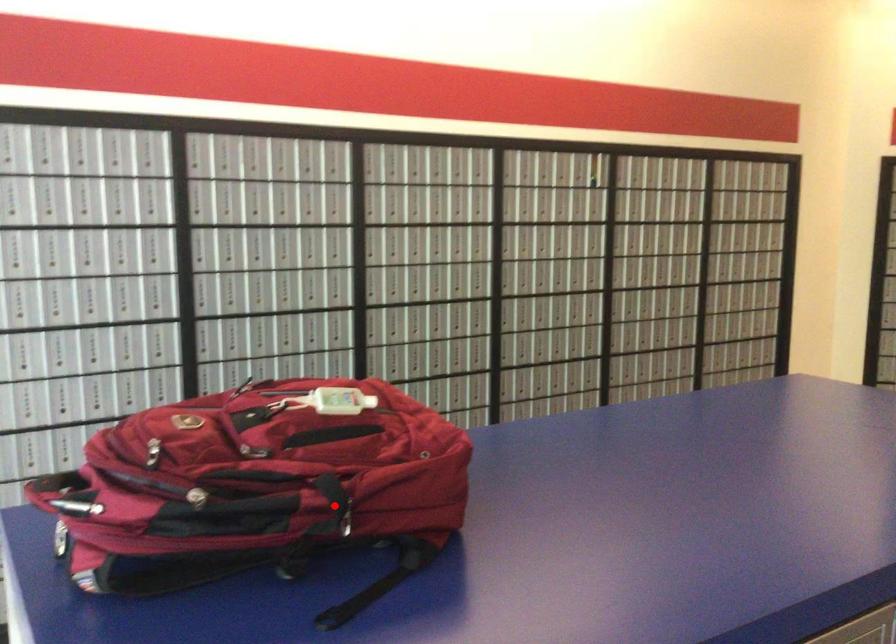
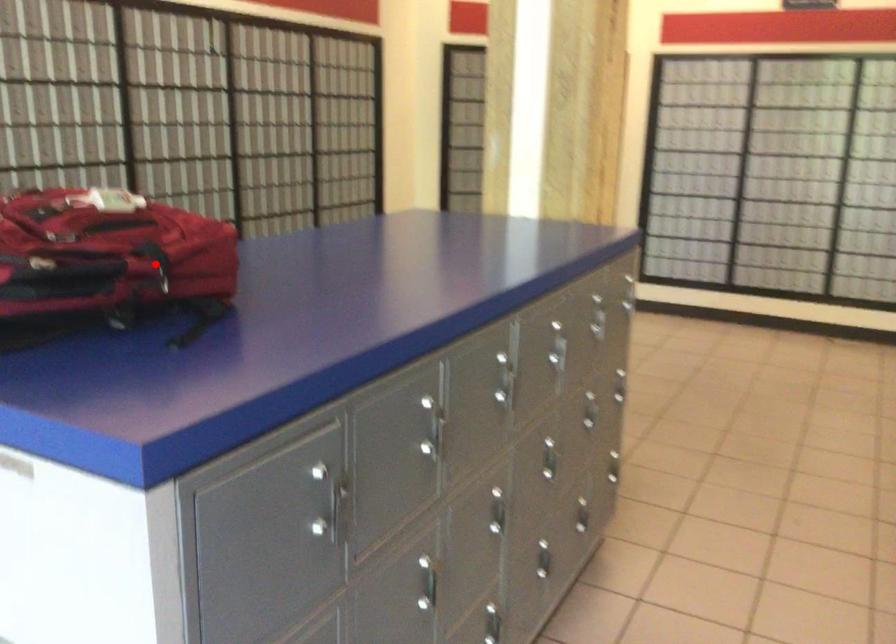
I am providing you with two images of the same scene from different viewpoints. A red point is marked on the first image and another point is marked on the second image. Does the point marked in image1 correspond to the same location as the one in image2?

Yes